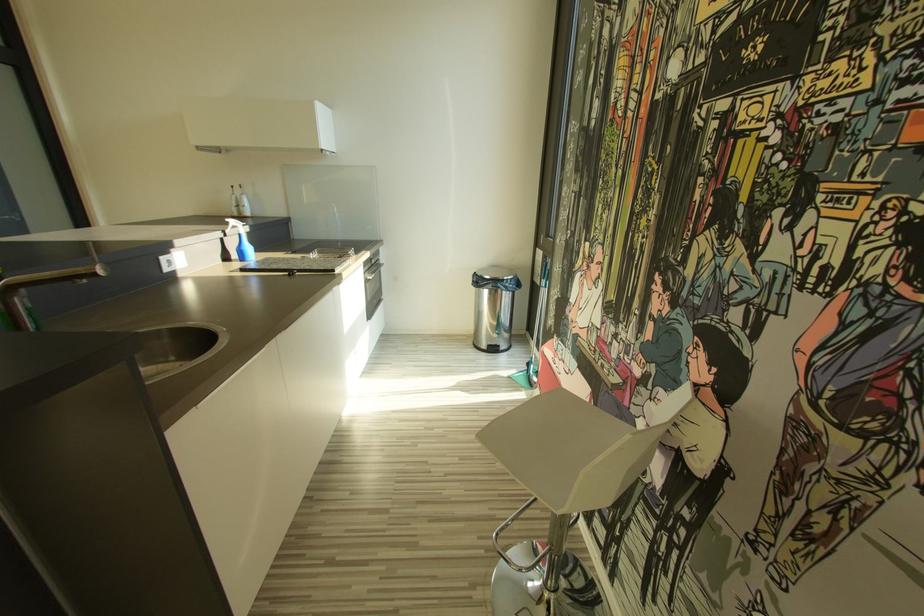
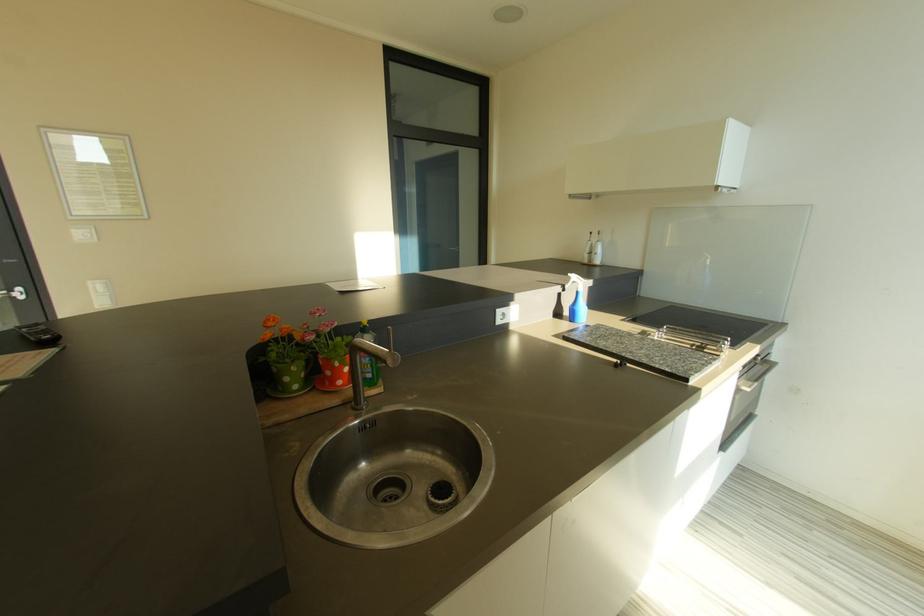
Question: Based on the continuous images, in which direction is the camera rotating? Reply with the corresponding letter.

Choices:
 (A) Left
 (B) Right
 (C) Up
 (D) Down

Answer: (A)